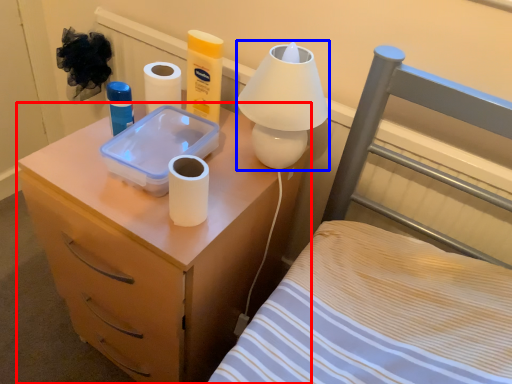
Question: Which object appears closest to the camera in this image, nightstand (highlighted by a red box) or table lamp (highlighted by a blue box)?

Choices:
 (A) nightstand
 (B) table lamp

Answer: (A)